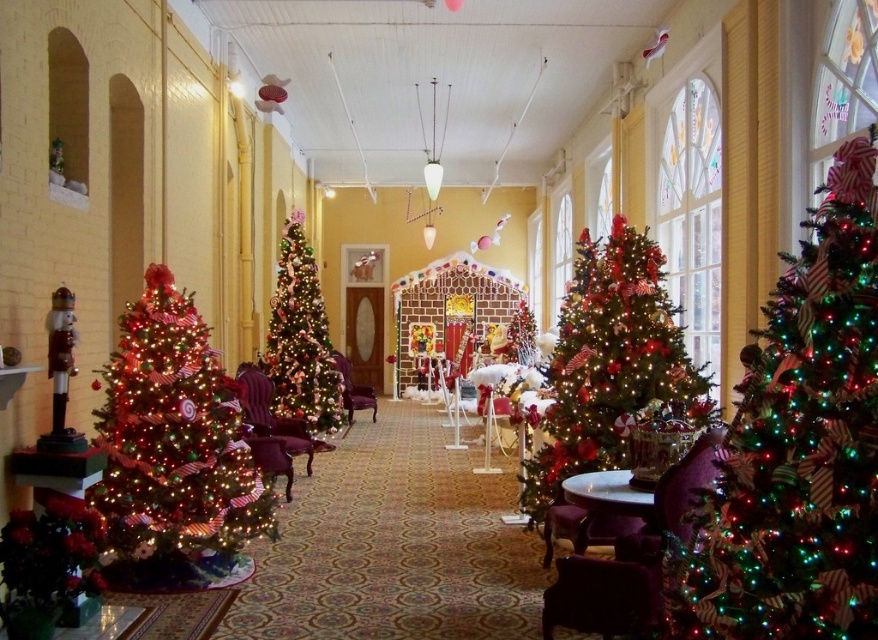
Question: Which point appears closest to the camera in this image?

Choices:
 (A) (606, 602)
 (B) (236, 369)
 (C) (322, 388)

Answer: (A)

Question: Does purple velvet armchair at lower right come in front of velvet purple armchair at center?

Choices:
 (A) yes
 (B) no

Answer: (A)

Question: Does shiny green christmas tree at left have a smaller size compared to velvet purple armchair at center?

Choices:
 (A) yes
 (B) no

Answer: (B)

Question: Among these points, which one is farthest from the camera?

Choices:
 (A) (350, 378)
 (B) (796, 451)
 (C) (290, 378)
 (D) (587, 608)

Answer: (A)

Question: Does shiny green christmas tree at right come behind shiny green christmas tree at left?

Choices:
 (A) yes
 (B) no

Answer: (B)

Question: Which point is closer to the camera?

Choices:
 (A) (347, 388)
 (B) (846, 467)
 (C) (675, 360)

Answer: (B)